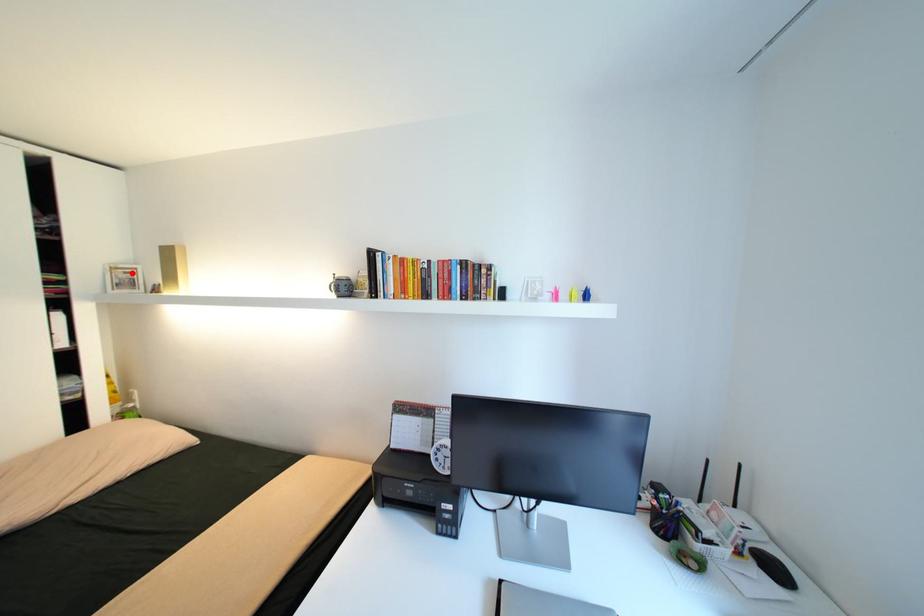
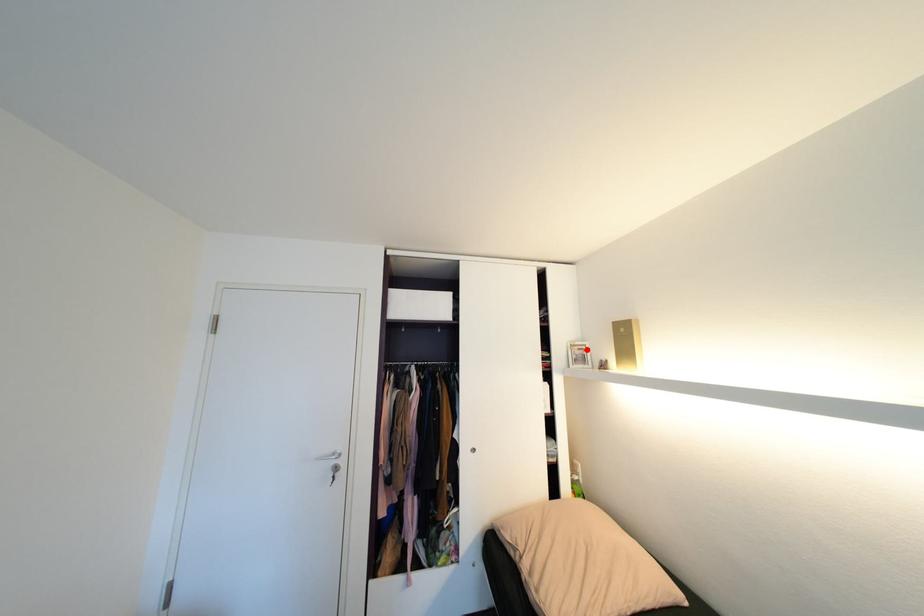
From the picture: I am providing you with two images of the same scene from different viewpoints. A red point is marked on the first image and another point is marked on the second image. Is the red point in image1 aligned with the point shown in image2?

Yes